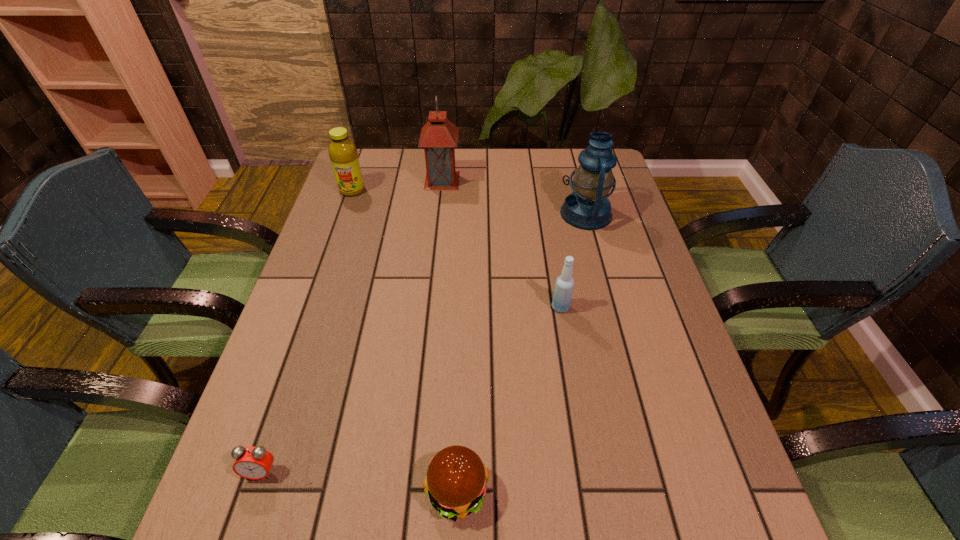
Where is `alarm clock at the left edge`? Image resolution: width=960 pixels, height=540 pixels. alarm clock at the left edge is located at coordinates (254, 463).

Where is `object that is at the right edge`? The width and height of the screenshot is (960, 540). object that is at the right edge is located at coordinates (588, 207).

Identify the location of object that is at the far left corner. Image resolution: width=960 pixels, height=540 pixels. point(343,154).

Locate an element on the screen. The image size is (960, 540). free space at the far edge of the desktop is located at coordinates (491, 160).

In the image, there is a desktop. At what (x,y) coordinates should I click in order to perform the action: click on vacant space at the left edge. Please return your answer as a coordinate pair (x, y). Image resolution: width=960 pixels, height=540 pixels. Looking at the image, I should click on (356, 204).

Identify the location of free location at the right edge of the desktop. The image size is (960, 540). (683, 363).

This screenshot has height=540, width=960. Identify the location of free space at the far left corner of the desktop. (378, 164).

Where is `vacant area that lies between the third tallest object and the right lantern`? This screenshot has height=540, width=960. vacant area that lies between the third tallest object and the right lantern is located at coordinates (469, 202).

This screenshot has width=960, height=540. Identify the location of free area in between the fifth tallest object and the fourth shortest object. (405, 341).

Where is `free space between the shortest object and the left lantern`? free space between the shortest object and the left lantern is located at coordinates (352, 326).